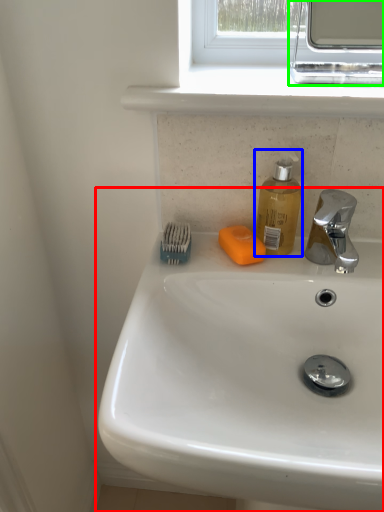
Question: Which object is positioned closest to sink (highlighted by a red box)? Select from soap dispenser (highlighted by a blue box) and medicine cabinet (highlighted by a green box).

Choices:
 (A) soap dispenser
 (B) medicine cabinet

Answer: (A)